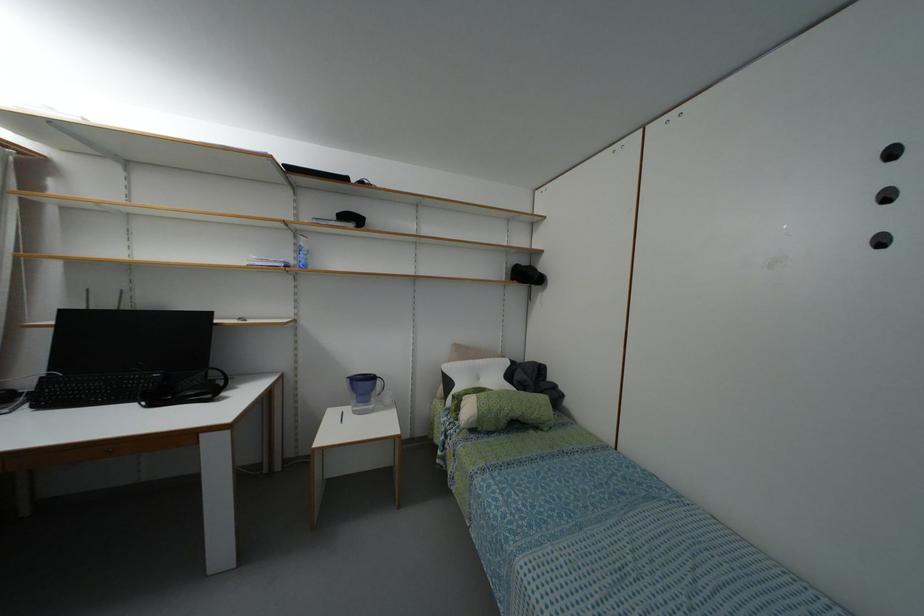
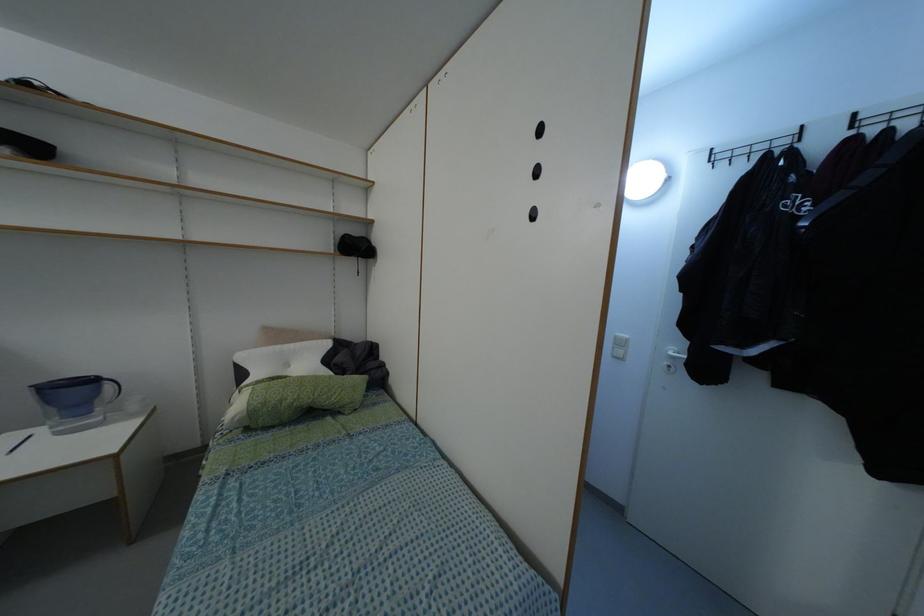
Question: The camera is either moving clockwise (left) or counter-clockwise (right) around the object. The first image is from the beginning of the video and the second image is from the end. Is the camera moving left or right when shooting the video?

Choices:
 (A) Left
 (B) Right

Answer: (A)